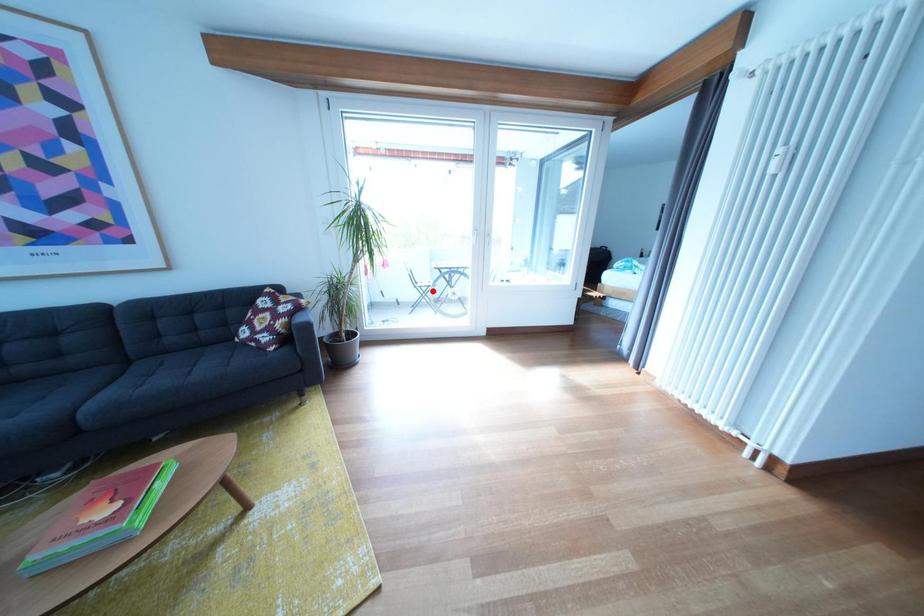
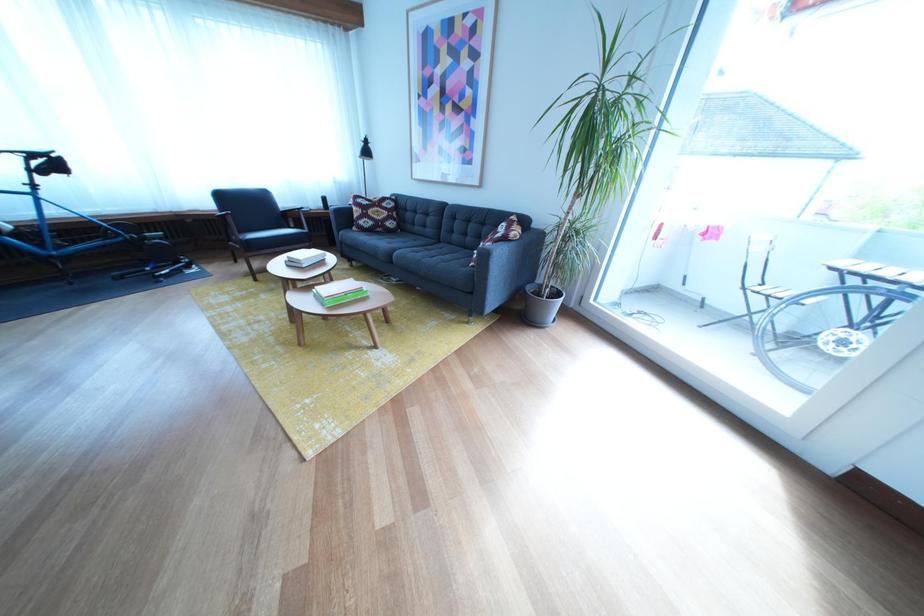
Locate, in the second image, the point that corresponds to the highlighted location in the first image.

(771, 294)